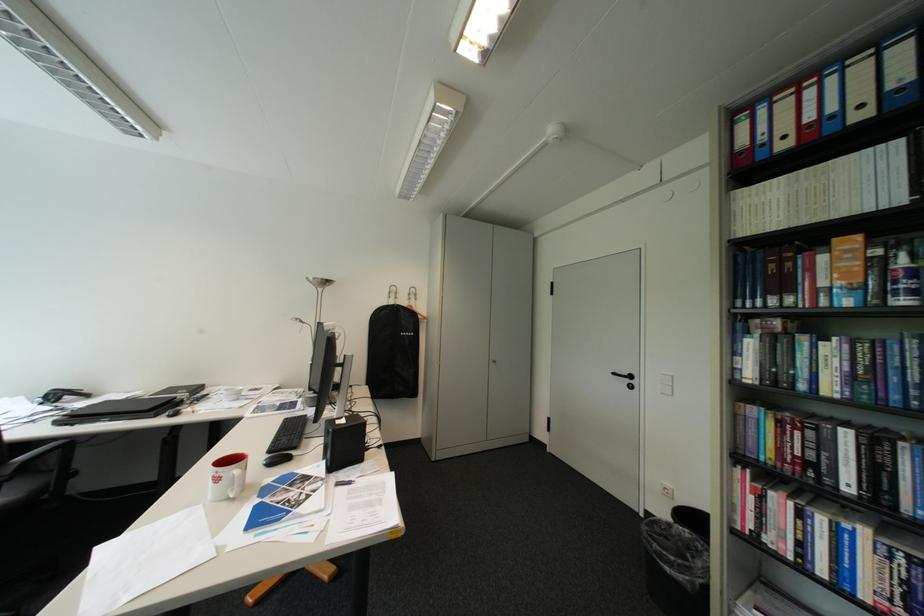
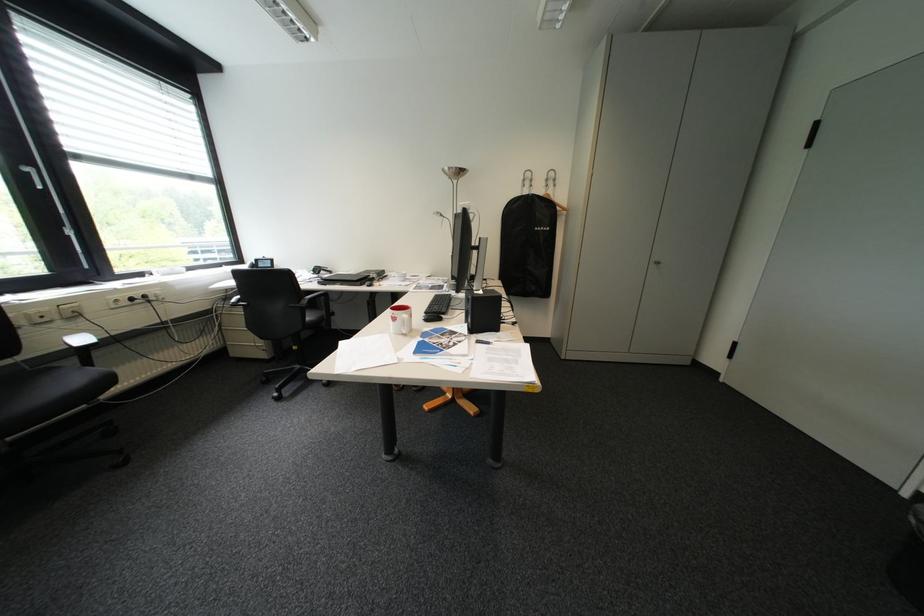
The point at (258, 467) is marked in the first image. Where is the corresponding point in the second image?

(423, 315)